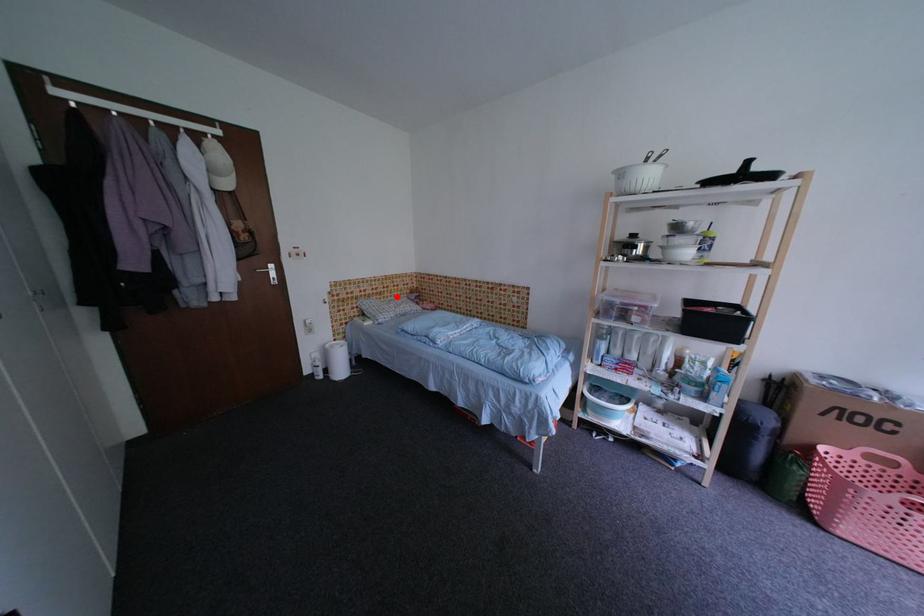
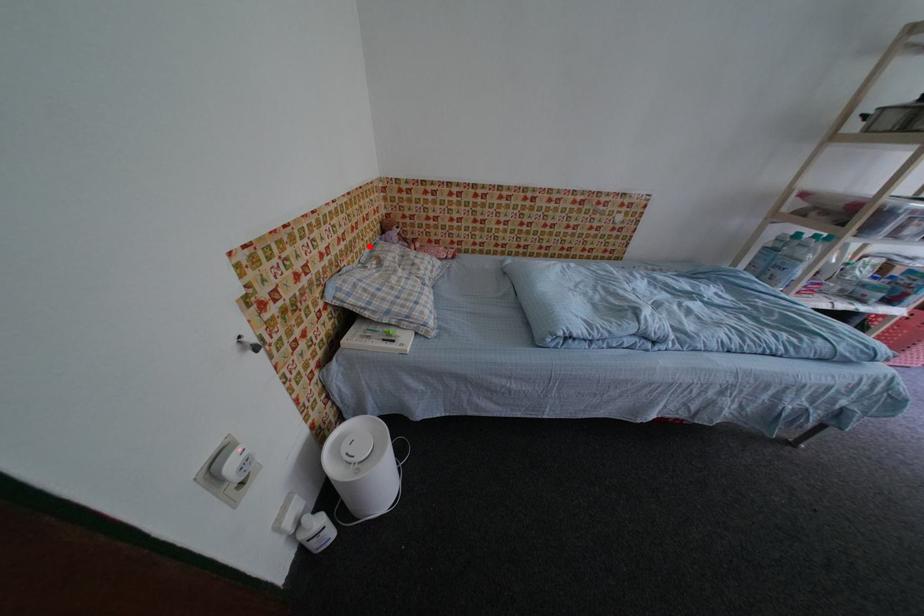
I am providing you with two images of the same scene from different viewpoints. A red point is marked on the first image and another point is marked on the second image. Do the highlighted points in image1 and image2 indicate the same real-world spot?

Yes